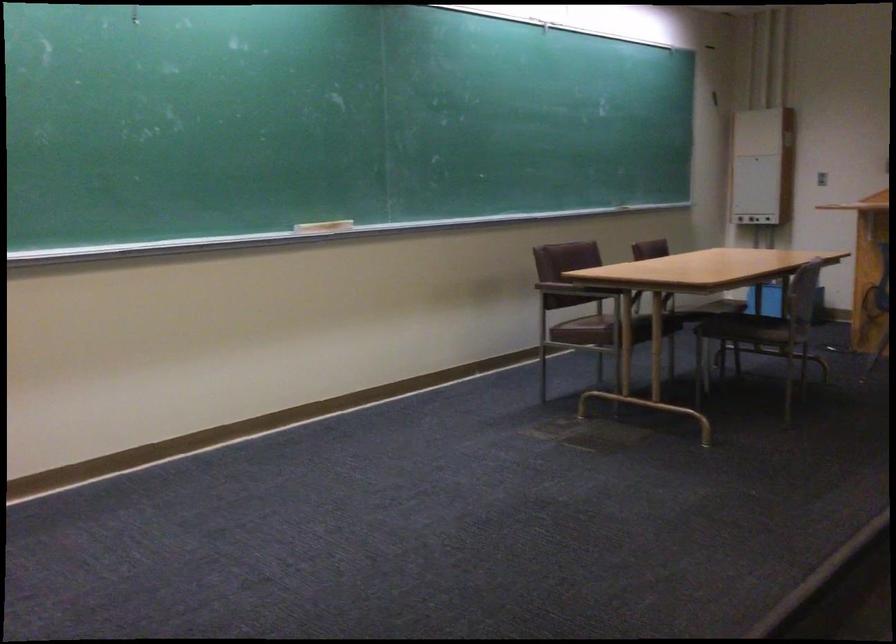
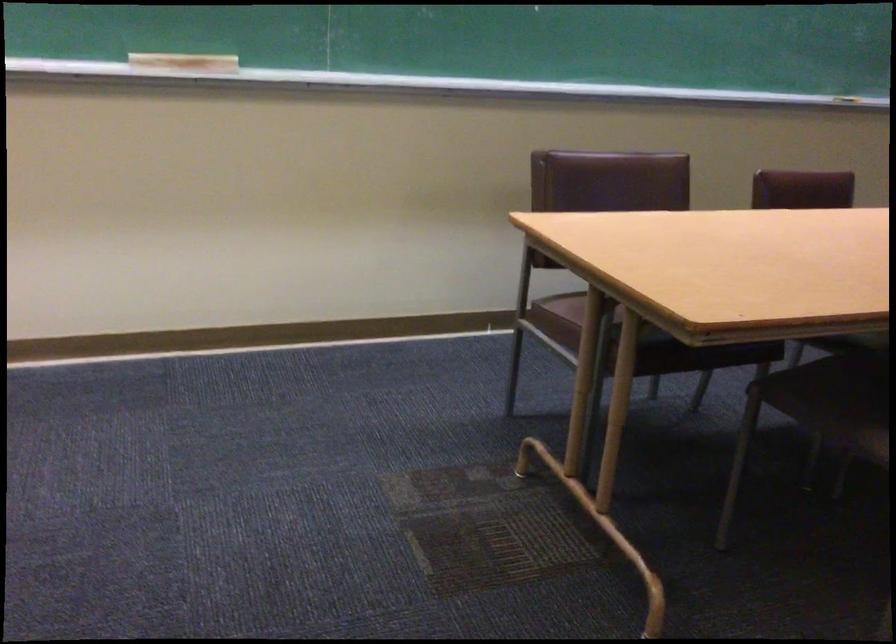
Find the pixel in the second image that matches [730,323] in the first image.

(833, 391)